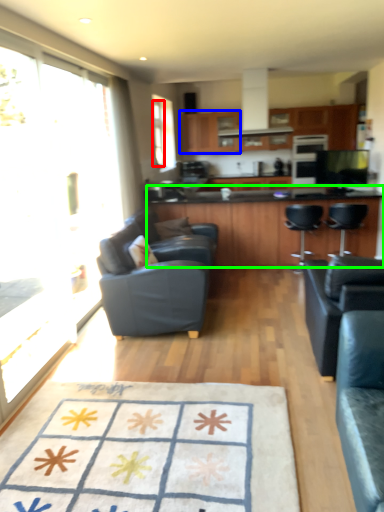
Question: Which object is positioned farthest from window (highlighted by a red box)? Select from cabinetry (highlighted by a blue box) and countertop (highlighted by a green box).

Choices:
 (A) cabinetry
 (B) countertop

Answer: (B)